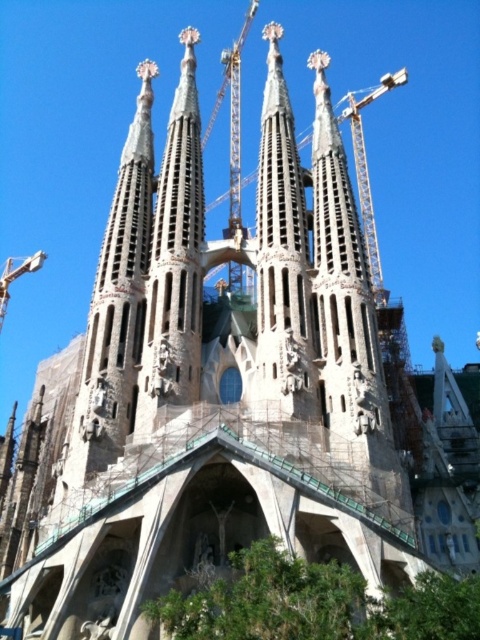
You are standing in front of the Sagrada Familia and want to take a photo that includes the beige stone spire at center. If your camera can focus on objects up to 200 feet away, will it be able to capture the spire clearly?

The distance between the beige stone spire at center and the camera is 204.82 feet, which exceeds the camera maximum focus range of 200 feet. Therefore, the camera will not be able to capture the spire clearly.

You are standing in front of the Sagrada Familia and notice two points on the building. One is at coordinate point (282, 243) and the other at point (244, 38). Which point is closer to you?

Point (282, 243) is closer to the viewer than point (244, 38).

You are standing in front of the Sagrada Familia and want to take a photo of the beige stone spire at center. If you look at the scene from the bottom edge of the image, where would you aim your camera vertically to capture the spire?

The beige stone spire at center is located at the 2D coordinate point 0.588 on the vertical axis. Since the bottom edge of the image corresponds to 0, you should aim your camera approximately 58.8 percent up from the bottom edge to capture the spire.